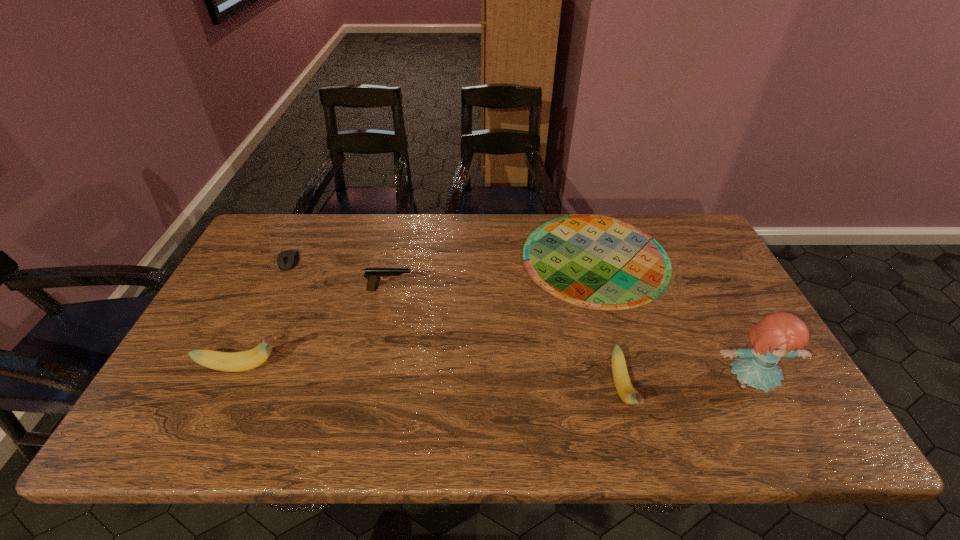
What are the coordinates of `free space located 0.320m at the muzzle of the fourth object from right to left` in the screenshot? It's located at (523, 289).

Find the location of a particular element. The image size is (960, 540). gameboard that is at the far edge is located at coordinates (596, 262).

Locate an element on the screen. Image resolution: width=960 pixels, height=540 pixels. computer equipment at the far edge is located at coordinates (286, 260).

Image resolution: width=960 pixels, height=540 pixels. What are the coordinates of `doll present at the near edge` in the screenshot? It's located at tap(778, 335).

You are a GUI agent. You are given a task and a screenshot of the screen. Output one action in this format:
    pyautogui.click(x=<x>, y=<y>)
    Task: Click on the banana situated at the left edge
    This screenshot has height=540, width=960.
    Given the screenshot: What is the action you would take?
    point(246,360)

The height and width of the screenshot is (540, 960). What are the coordinates of `computer equipment that is at the left edge` in the screenshot? It's located at (286, 260).

You are a GUI agent. You are given a task and a screenshot of the screen. Output one action in this format:
    pyautogui.click(x=<x>, y=<y>)
    Task: Click on the gameboard situated at the right edge
    Image resolution: width=960 pixels, height=540 pixels.
    Given the screenshot: What is the action you would take?
    pyautogui.click(x=596, y=262)

I want to click on doll that is at the right edge, so click(x=778, y=335).

Identify the location of object at the far left corner. This screenshot has height=540, width=960. (286, 260).

I want to click on object that is at the near left corner, so click(x=246, y=360).